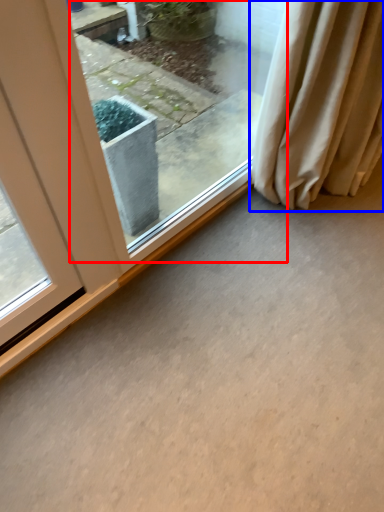
Question: Which object is further to the camera taking this photo, window (highlighted by a red box) or curtain (highlighted by a blue box)?

Choices:
 (A) window
 (B) curtain

Answer: (B)